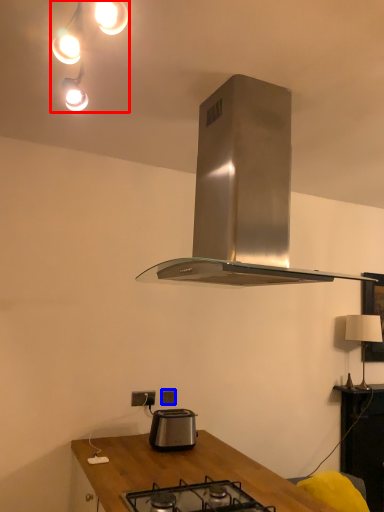
Question: Among these objects, which one is nearest to the camera, light fixture (highlighted by a red box) or power plugs and sockets (highlighted by a blue box)?

Choices:
 (A) light fixture
 (B) power plugs and sockets

Answer: (A)